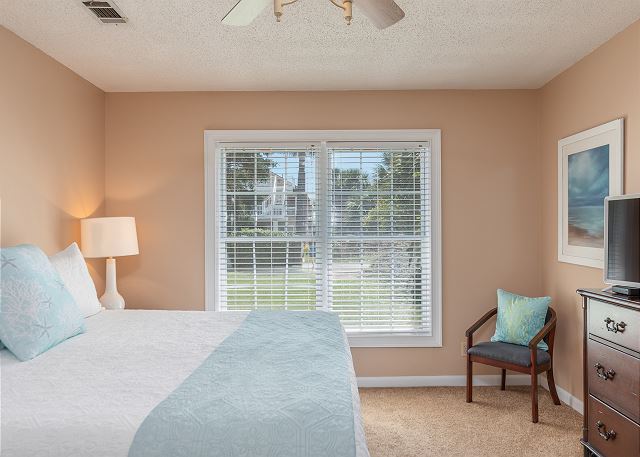
This screenshot has width=640, height=457. Find the location of `beige walls with white trim`. beige walls with white trim is located at coordinates (511, 197), (566, 116), (140, 102), (36, 131), (404, 365), (379, 379), (566, 392), (70, 151).